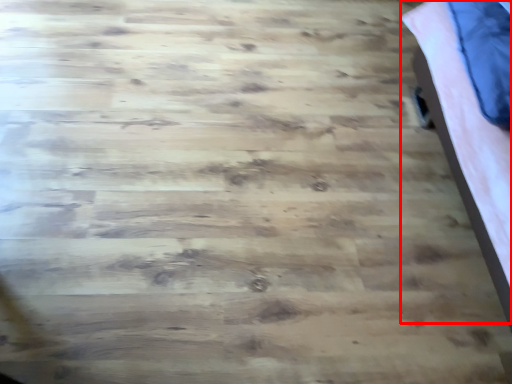
Question: In this image, where is bed (annotated by the red box) located relative to pillow?

Choices:
 (A) right
 (B) left

Answer: (A)